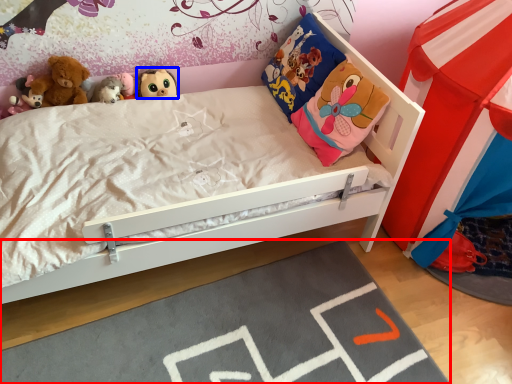
Question: Which object is closer to the camera taking this photo, plain (highlighted by a red box) or toy (highlighted by a blue box)?

Choices:
 (A) plain
 (B) toy

Answer: (A)